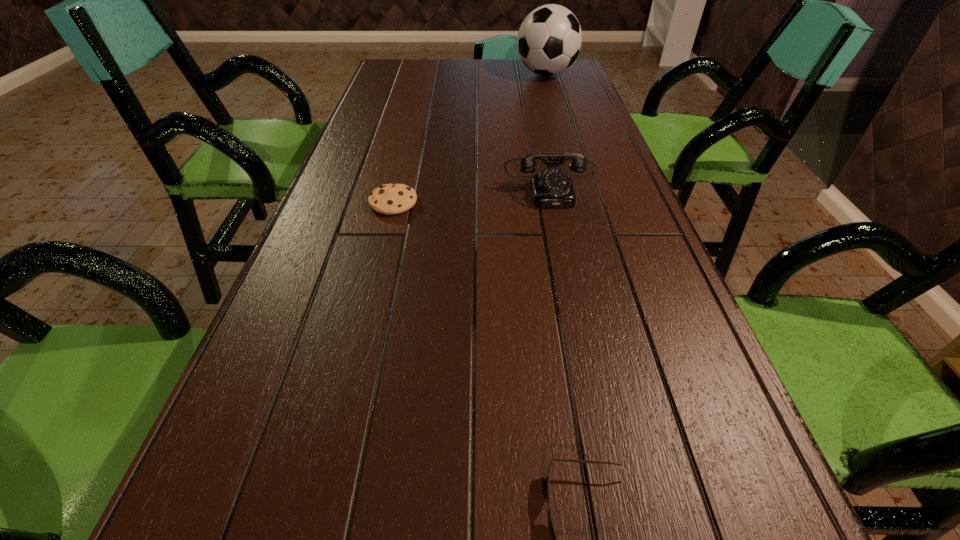
This screenshot has height=540, width=960. Find the location of `vacant area that lies between the second tallest object and the soccer ball`. vacant area that lies between the second tallest object and the soccer ball is located at coordinates pyautogui.click(x=549, y=128).

What are the coordinates of `empty space between the cookie and the third shortest object` in the screenshot? It's located at (472, 192).

I want to click on free spot between the cookie and the tallest object, so click(469, 138).

Locate an element on the screen. empty space that is in between the farthest object and the second shortest object is located at coordinates (469, 138).

You are a GUI agent. You are given a task and a screenshot of the screen. Output one action in this format:
    pyautogui.click(x=<x>, y=<y>)
    Task: Click on the object that is the third closest to the second tallest object
    The width and height of the screenshot is (960, 540).
    Given the screenshot: What is the action you would take?
    pyautogui.click(x=553, y=535)

Locate which object is the third closest to the nearest object. Please provide its 2D coordinates. Your answer should be formatted as a tuple, i.e. [(x, y)], where the tuple contains the x and y coordinates of a point satisfying the conditions above.

[(549, 39)]